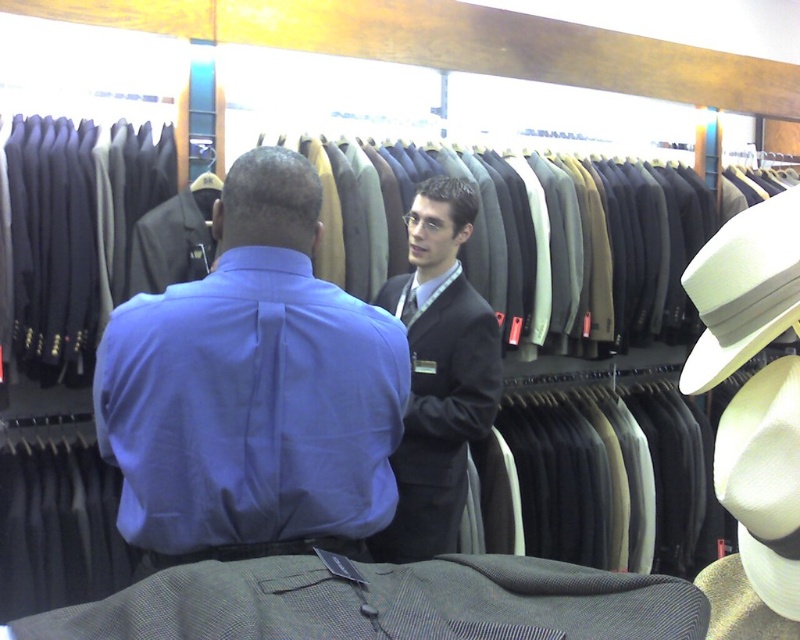
You are standing in a clothing store and need to reach a point that is exactly at coordinate point (438, 284). If you are currently 2 meters away from that point, how much further do you need to walk to reach it?

The distance of point (438, 284) from camera is 2.14 meters. Since you are currently 2 meters away, you need to walk an additional 0.14 meters to reach the point.

You are standing at the entrance of the clothing store and want to go to the point marked as point (413, 490). However, there is an obstacle at point (786, 291). Based on their positions, can you walk directly to your destination without going around the obstacle?

Point (413, 490) is behind point (786, 291), so you cannot walk directly to your destination without going around the obstacle.